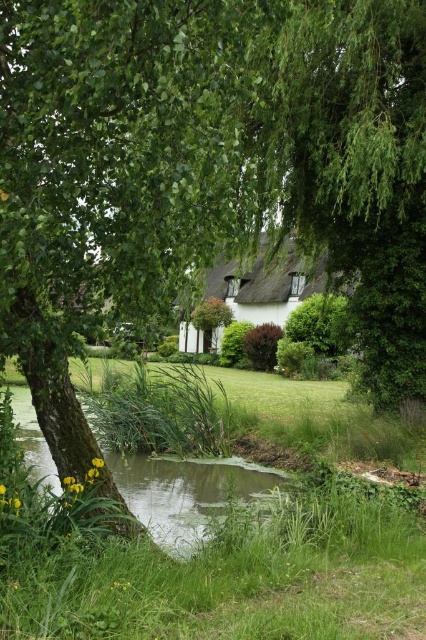
Is green grassy water at lower left thinner than thatched roof cottage at center?

Yes, green grassy water at lower left is thinner than thatched roof cottage at center.

Does green grassy water at lower left have a lesser height compared to thatched roof cottage at center?

Indeed, green grassy water at lower left has a lesser height compared to thatched roof cottage at center.

The image size is (426, 640). Identify the location of green grassy water at lower left. (189, 492).

You are a GUI agent. You are given a task and a screenshot of the screen. Output one action in this format:
    pyautogui.click(x=<x>, y=<y>)
    Task: Click on the green grassy water at lower left
    Image resolution: width=426 pixels, height=640 pixels.
    Given the screenshot: What is the action you would take?
    pyautogui.click(x=189, y=492)

Looking at this image, does green grass at lower left have a greater height compared to green grassy water at lower left?

Yes.

Who is more distant from viewer, (351, 552) or (273, 477)?

Positioned behind is point (273, 477).

Who is more distant from viewer, (121, 592) or (108, 458)?

The point (108, 458) is more distant.

At what (x,y) coordinates should I click in order to perform the action: click on green grass at lower left. Please return your answer as a coordinate pair (x, y). The height and width of the screenshot is (640, 426). Looking at the image, I should click on (227, 561).

Does green grass at lower left have a larger size compared to thatched roof cottage at center?

Incorrect, green grass at lower left is not larger than thatched roof cottage at center.

Who is more forward, (279,506) or (302,269)?

Point (279,506)

Who is more forward, (112, 600) or (221, 296)?

Point (112, 600) is more forward.

At what (x,y) coordinates should I click in order to perform the action: click on green grass at lower left. Please return your answer as a coordinate pair (x, y). The image size is (426, 640). Looking at the image, I should click on (227, 561).